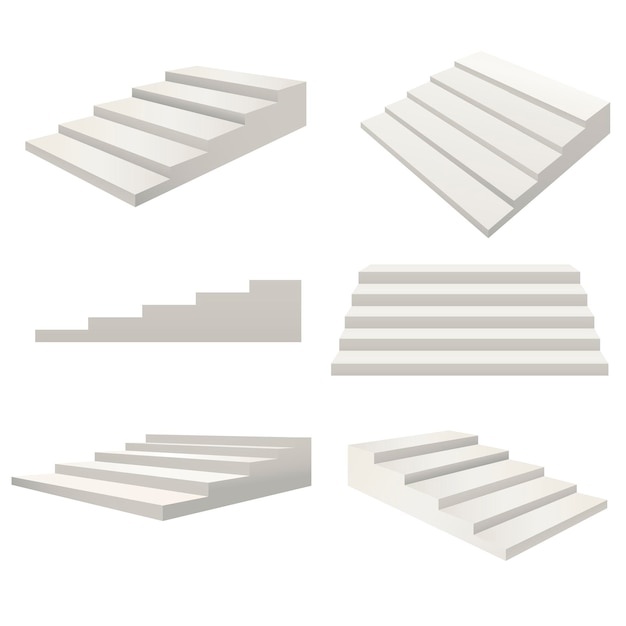
The image size is (626, 626). I want to click on white staircases, so click(163, 126), click(452, 124), click(493, 324), click(476, 496), click(177, 470), click(208, 309).